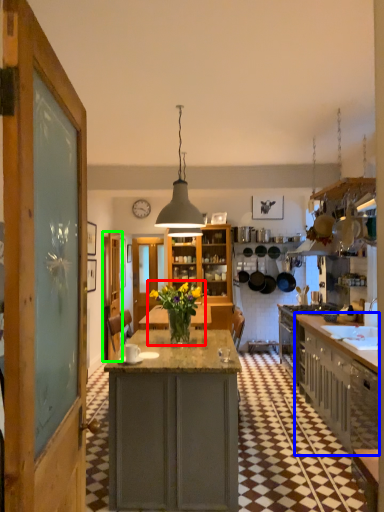
Question: Considering the real-world distances, which object is closest to floral arrangement (highlighted by a red box)? cabinetry (highlighted by a blue box) or door (highlighted by a green box).

Choices:
 (A) cabinetry
 (B) door

Answer: (A)